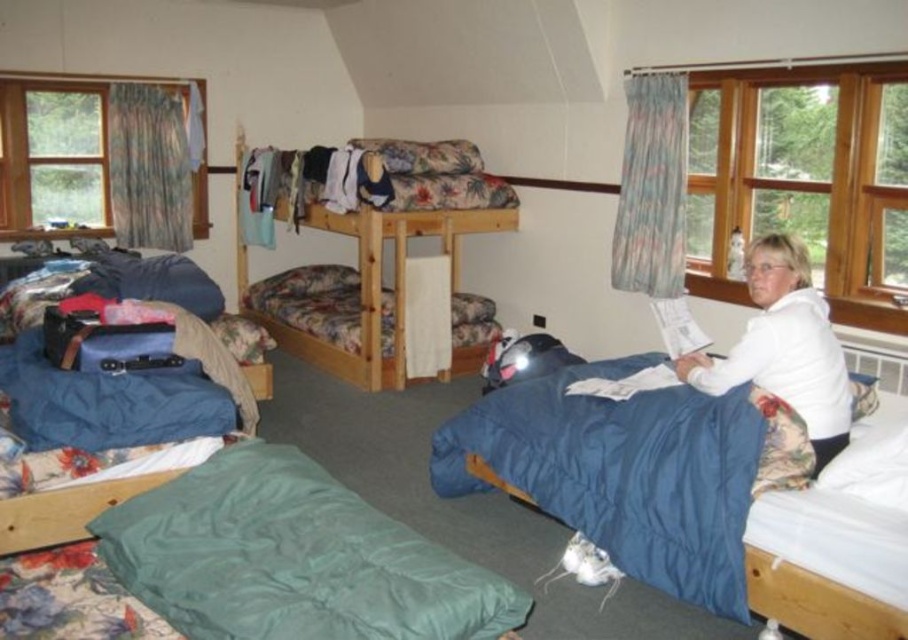
Question: Does white soft blanket at lower right appear over transparent glass window at upper left?

Choices:
 (A) yes
 (B) no

Answer: (B)

Question: Based on their relative distances, which object is farther from the clear glass window at upper right?

Choices:
 (A) white soft blanket at lower right
 (B) blue quilted bed at lower right
 (C) transparent glass window at upper left
 (D) floral fabric bunk bed at upper center

Answer: (C)

Question: Which point is closer to the camera?

Choices:
 (A) (818, 252)
 (B) (201, 205)
 (C) (783, 294)

Answer: (C)

Question: Is clear glass window at upper right bigger than white soft blanket at lower right?

Choices:
 (A) no
 (B) yes

Answer: (B)

Question: From the image, what is the correct spatial relationship of blue quilted bed at lower right in relation to white soft blanket at lower right?

Choices:
 (A) right
 (B) left

Answer: (B)

Question: Which point is farther to the camera?

Choices:
 (A) (847, 381)
 (B) (201, 221)

Answer: (B)